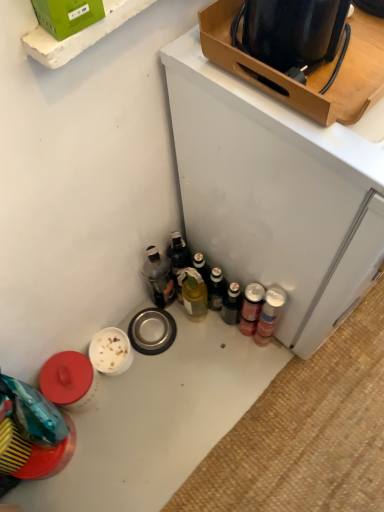
This screenshot has width=384, height=512. Identify the location of vacant space in front of metallic silver can at lower right. (258, 384).